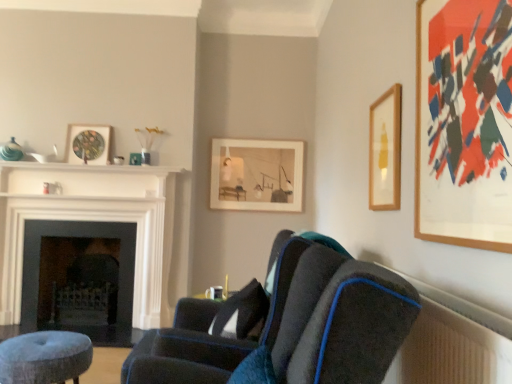
This screenshot has width=512, height=384. In order to click on free spot above white glossy fireplace at left, arranged as the first fireplace when viewed from the front (from a real-world perspective) in this screenshot , I will do `click(92, 173)`.